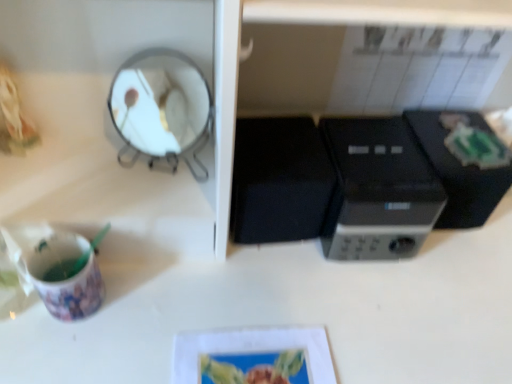
This screenshot has width=512, height=384. Describe the element at coordinates (279, 180) in the screenshot. I see `black matte microwave at center, acting as the second appliance starting from the right` at that location.

Measure the distance between point [302,119] and camera.

Point [302,119] is 24.65 inches from camera.

Where is `black plastic microwave at center, the 2th appliance positioned from the left`? This screenshot has height=384, width=512. black plastic microwave at center, the 2th appliance positioned from the left is located at coordinates (458, 175).

Describe the element at coordinates (458, 175) in the screenshot. I see `black plastic microwave at center, which is the first appliance in right-to-left order` at that location.

At what (x,y) coordinates should I click in order to perform the action: click on black matte microwave at center, which appears as the first appliance when viewed from the left. Please return your answer as a coordinate pair (x, y). Looking at the image, I should click on (279, 180).

Is metallic silver mirror at upper left smaller than black matte microwave at center, acting as the second appliance starting from the right?

Yes.

Is metallic silver mirror at upper left positioned with its back to black matte microwave at center, which appears as the first appliance when viewed from the left?

metallic silver mirror at upper left does not have its back to black matte microwave at center, which appears as the first appliance when viewed from the left.

Between metallic silver mirror at upper left and black matte microwave at center, which appears as the first appliance when viewed from the left, which one appears on the left side from the viewer's perspective?

From the viewer's perspective, metallic silver mirror at upper left appears more on the left side.

You are a GUI agent. You are given a task and a screenshot of the screen. Output one action in this format:
    pyautogui.click(x=<x>, y=<y>)
    Task: Click on the mirror above the black matte microwave at center, acting as the second appliance starting from the right (from the image's perspective)
    The width and height of the screenshot is (512, 384).
    Given the screenshot: What is the action you would take?
    pyautogui.click(x=162, y=108)

Which of these two, metallic silver mirror at upper left or black plastic microwave at center, stands taller?

black plastic microwave at center.

Based on the photo, is metallic silver mirror at upper left positioned behind black plastic microwave at center?

No, metallic silver mirror at upper left is closer to the viewer.

Can we say metallic silver mirror at upper left lies outside black plastic microwave at center?

Yes, metallic silver mirror at upper left is located beyond the bounds of black plastic microwave at center.

Considering the sizes of objects black matte microwave at center, acting as the second appliance starting from the right, and matte plastic cup at lower left in the image provided, who is bigger, black matte microwave at center, acting as the second appliance starting from the right, or matte plastic cup at lower left?

With larger size is black matte microwave at center, acting as the second appliance starting from the right.

Which is in front, black matte microwave at center, which appears as the first appliance when viewed from the left, or matte plastic cup at lower left?

matte plastic cup at lower left.

Is black matte microwave at center, which appears as the first appliance when viewed from the left, looking in the opposite direction of matte plastic cup at lower left?

That's not correct — black matte microwave at center, which appears as the first appliance when viewed from the left, is not looking away from matte plastic cup at lower left.

Between black matte microwave at center, acting as the second appliance starting from the right, and matte plastic cup at lower left, which one has less height?

matte plastic cup at lower left is shorter.

Considering the positions of objects black matte microwave at center, which appears as the first appliance when viewed from the left, and black plastic microwave at center, which is the first appliance in right-to-left order, in the image provided, who is more to the right, black matte microwave at center, which appears as the first appliance when viewed from the left, or black plastic microwave at center, which is the first appliance in right-to-left order,?

black plastic microwave at center, which is the first appliance in right-to-left order.

Is black matte microwave at center, acting as the second appliance starting from the right, not close to black plastic microwave at center, which is the first appliance in right-to-left order?

Actually, black matte microwave at center, acting as the second appliance starting from the right, and black plastic microwave at center, which is the first appliance in right-to-left order, are a little close together.

Identify the location of appliance located in front of the black plastic microwave at center, which is the first appliance in right-to-left order. The height and width of the screenshot is (384, 512). (279, 180).

Could you tell me if black matte microwave at center, acting as the second appliance starting from the right, is facing black plastic microwave at center, which is the first appliance in right-to-left order?

No, black matte microwave at center, acting as the second appliance starting from the right, is not turned towards black plastic microwave at center, which is the first appliance in right-to-left order.

Is point (29, 262) positioned behind point (183, 88)?

That is False.

From the image's perspective, who appears lower, matte plastic cup at lower left or metallic silver mirror at upper left?

matte plastic cup at lower left appears lower in the image.

Does matte plastic cup at lower left have a smaller size compared to metallic silver mirror at upper left?

Yes, matte plastic cup at lower left is smaller than metallic silver mirror at upper left.

The height and width of the screenshot is (384, 512). Find the location of `mirror above the matte plastic cup at lower left (from a real-world perspective)`. mirror above the matte plastic cup at lower left (from a real-world perspective) is located at coordinates (162, 108).

From a real-world perspective, between black plastic microwave at center, which is the first appliance in right-to-left order, and black matte microwave at center, acting as the second appliance starting from the right, who is vertically higher?

From a 3D spatial view, black matte microwave at center, acting as the second appliance starting from the right, is above.

Are black plastic microwave at center, which is the first appliance in right-to-left order, and black matte microwave at center, acting as the second appliance starting from the right, located far from each other?

No, black plastic microwave at center, which is the first appliance in right-to-left order, is not far from black matte microwave at center, acting as the second appliance starting from the right.

Based on their positions, is black plastic microwave at center, which is the first appliance in right-to-left order, located to the left or right of black matte microwave at center, which appears as the first appliance when viewed from the left?

Clearly, black plastic microwave at center, which is the first appliance in right-to-left order, is on the right of black matte microwave at center, which appears as the first appliance when viewed from the left, in the image.

Can you confirm if black plastic microwave at center, the 2th appliance positioned from the left, is smaller than black matte microwave at center, acting as the second appliance starting from the right?

Correct, black plastic microwave at center, the 2th appliance positioned from the left, occupies less space than black matte microwave at center, acting as the second appliance starting from the right.

Is black matte microwave at center, which appears as the first appliance when viewed from the left, to the right of black plastic microwave at center from the viewer's perspective?

No, black matte microwave at center, which appears as the first appliance when viewed from the left, is not to the right of black plastic microwave at center.

Can you confirm if black matte microwave at center, acting as the second appliance starting from the right, is thinner than black plastic microwave at center?

Yes, black matte microwave at center, acting as the second appliance starting from the right, is thinner than black plastic microwave at center.

Is black matte microwave at center, which appears as the first appliance when viewed from the left, in front of or behind black plastic microwave at center in the image?

Visually, black matte microwave at center, which appears as the first appliance when viewed from the left, is located behind black plastic microwave at center.

Considering the points (270, 241) and (344, 156), which point is behind, point (270, 241) or point (344, 156)?

Positioned behind is point (270, 241).

Locate an element on the screen. This screenshot has width=512, height=384. appliance that is the 2nd one when counting downward from the metallic silver mirror at upper left (from the image's perspective) is located at coordinates (279, 180).

Find the location of `mirror that is in front of the black plastic microwave at center`. mirror that is in front of the black plastic microwave at center is located at coordinates click(x=162, y=108).

From the image, which object appears to be farther from black matte microwave at center, which appears as the first appliance when viewed from the left, black plastic microwave at center or metallic silver mirror at upper left?

Based on the image, metallic silver mirror at upper left appears to be further to black matte microwave at center, which appears as the first appliance when viewed from the left.

Estimate the real-world distances between objects in this image. Which object is closer to black plastic microwave at center, matte plastic cup at lower left or black plastic microwave at center, which is the first appliance in right-to-left order?

black plastic microwave at center, which is the first appliance in right-to-left order, lies closer to black plastic microwave at center than the other object.

From the picture: From the image, which object appears to be nearer to black plastic microwave at center, the 2th appliance positioned from the left, matte plastic cup at lower left or metallic silver mirror at upper left?

metallic silver mirror at upper left is positioned closer to the anchor black plastic microwave at center, the 2th appliance positioned from the left.

From the picture: Looking at the image, which one is located further to black plastic microwave at center, the 2th appliance positioned from the left, metallic silver mirror at upper left or black plastic microwave at center?

Based on the image, metallic silver mirror at upper left appears to be further to black plastic microwave at center, the 2th appliance positioned from the left.

Looking at the image, which one is located closer to black plastic microwave at center, matte plastic cup at lower left or black matte microwave at center, acting as the second appliance starting from the right?

black matte microwave at center, acting as the second appliance starting from the right, is closer to black plastic microwave at center.

Considering their positions, is metallic silver mirror at upper left positioned closer to black plastic microwave at center than black plastic microwave at center, which is the first appliance in right-to-left order?

The object closer to black plastic microwave at center is black plastic microwave at center, which is the first appliance in right-to-left order.

From the image, which object appears to be nearer to matte plastic cup at lower left, metallic silver mirror at upper left or black matte microwave at center, which appears as the first appliance when viewed from the left?

Among the two, metallic silver mirror at upper left is located nearer to matte plastic cup at lower left.

Based on their spatial positions, is black plastic microwave at center, the 2th appliance positioned from the left, or black plastic microwave at center closer to metallic silver mirror at upper left?

black plastic microwave at center is closer to metallic silver mirror at upper left.

Where is `appliance between matte plastic cup at lower left and black plastic microwave at center in the horizontal direction`? This screenshot has width=512, height=384. appliance between matte plastic cup at lower left and black plastic microwave at center in the horizontal direction is located at coordinates (279, 180).

Where is `mirror between matte plastic cup at lower left and black plastic microwave at center, which is the first appliance in right-to-left order, from left to right`? The width and height of the screenshot is (512, 384). mirror between matte plastic cup at lower left and black plastic microwave at center, which is the first appliance in right-to-left order, from left to right is located at coordinates (162, 108).

Identify the location of mirror between matte plastic cup at lower left and black matte microwave at center, which appears as the first appliance when viewed from the left. The width and height of the screenshot is (512, 384). (162, 108).

The image size is (512, 384). I want to click on mirror located between matte plastic cup at lower left and black plastic microwave at center in the left-right direction, so click(162, 108).